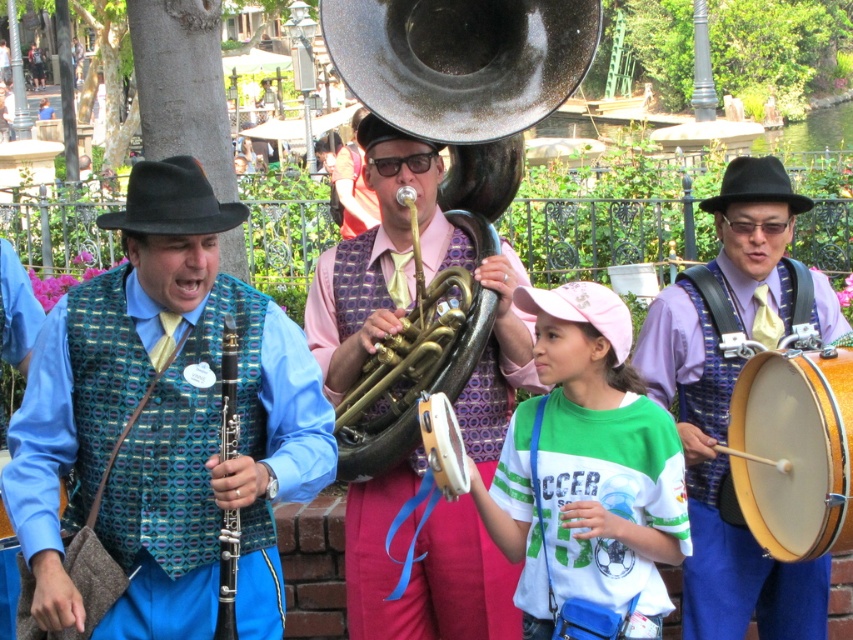
In the scene shown: Between shiny brass trumpet at center and wooden drum at center, which one is positioned lower?

wooden drum at center is lower down.

Looking at this image, between shiny brass trumpet at center and wooden drum at center, which one has less height?

shiny brass trumpet at center is shorter.

Between point (334, 42) and point (15, 536), which one is positioned behind?

Positioned behind is point (334, 42).

Locate an element on the screen. This screenshot has height=640, width=853. shiny brass trumpet at center is located at coordinates (465, 81).

Does gold polished tuba at center have a greater height compared to shiny brass trumpet at center?

Correct, gold polished tuba at center is much taller as shiny brass trumpet at center.

At what (x,y) coordinates should I click in order to perform the action: click on gold polished tuba at center. Please return your answer as a coordinate pair (x, y). The height and width of the screenshot is (640, 853). Looking at the image, I should click on (412, 291).

Can you confirm if matte gold drum at right is taller than wooden drum at center?

No.

Between point (780, 272) and point (4, 532), which one is positioned in front?

Positioned in front is point (4, 532).

What do you see at coordinates (730, 396) in the screenshot? I see `matte gold drum at right` at bounding box center [730, 396].

Where is `matte gold drum at right`? This screenshot has height=640, width=853. matte gold drum at right is located at coordinates (730, 396).